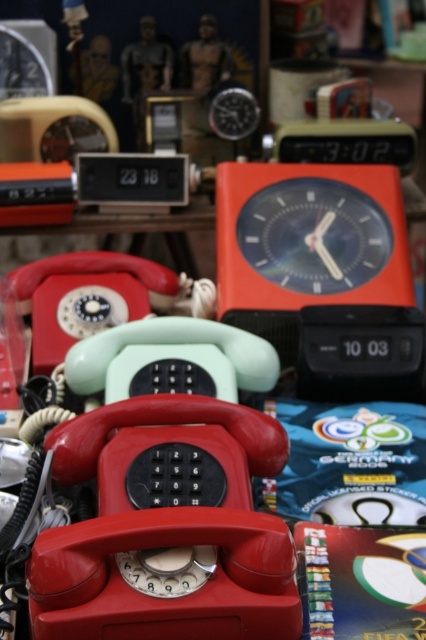
Is matte black clock at center positioned in front of metallic silver clock at upper left?

Yes, matte black clock at center is closer to the viewer.

Who is more distant from viewer, (391,244) or (20,28)?

The point (20,28) is more distant.

What do you see at coordinates (313, 234) in the screenshot? I see `matte black clock at center` at bounding box center [313, 234].

This screenshot has width=426, height=640. I want to click on matte black clock at center, so (313, 234).

Does metallic silver clock at upper left appear under metallic silver clock at upper center?

No.

Where is `metallic silver clock at upper left`? metallic silver clock at upper left is located at coordinates (26, 58).

Does point (46, 36) come behind point (210, 112)?

Yes.

Locate an element on the screen. Image resolution: width=426 pixels, height=640 pixels. metallic silver clock at upper left is located at coordinates (26, 58).

Does matte red telephone at center appear over matte orange alarm clock at center?

Incorrect, matte red telephone at center is not positioned above matte orange alarm clock at center.

Does matte red telephone at center have a greater height compared to matte orange alarm clock at center?

No, matte red telephone at center is not taller than matte orange alarm clock at center.

Does point (187, 488) come closer to viewer compared to point (307, 275)?

Yes, point (187, 488) is in front of point (307, 275).

Identify the location of matte red telephone at center. (166, 525).